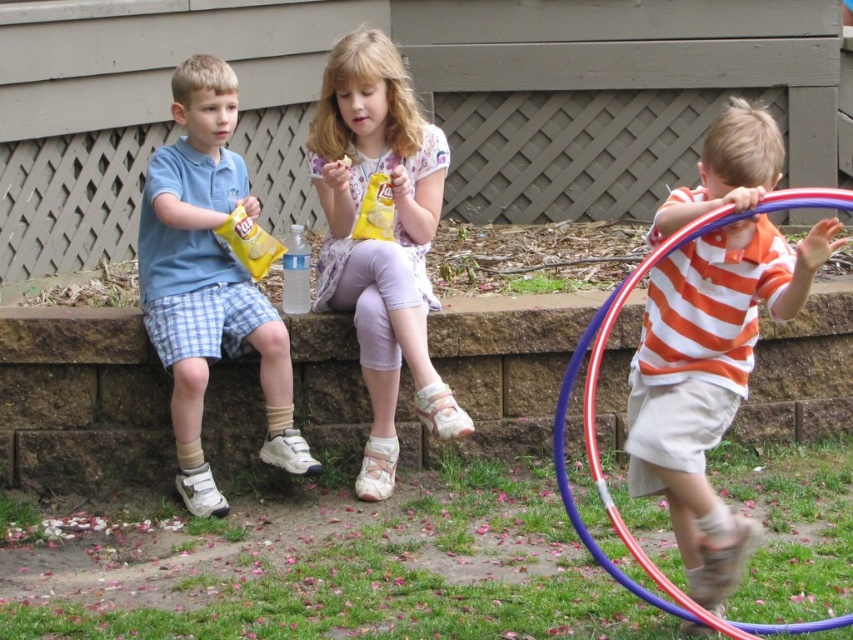
Question: Which point appears closest to the camera in this image?

Choices:
 (A) (397, 349)
 (B) (605, 483)

Answer: (A)

Question: In this image, where is matte yellow snack packet at center located relative to matte blue shirt at left?

Choices:
 (A) above
 (B) below

Answer: (A)

Question: Does matte yellow snack packet at center appear on the right side of metallic blue and red hula hoop at right?

Choices:
 (A) no
 (B) yes

Answer: (A)

Question: Which of the following is the closest to the observer?

Choices:
 (A) (712, 221)
 (B) (318, 467)
 (C) (338, 268)

Answer: (A)

Question: Does matte blue shirt at left have a lesser width compared to metallic blue and red hula hoop at right?

Choices:
 (A) no
 (B) yes

Answer: (B)

Question: Based on their relative distances, which object is farther from the metallic blue and red hula hoop at right?

Choices:
 (A) matte blue shirt at left
 (B) matte yellow snack packet at center

Answer: (A)